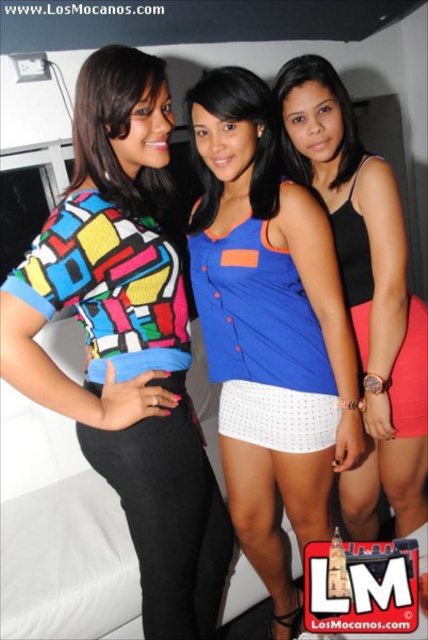
Is blue fabric top at center wider than blue fabric blouse at center?

Yes, blue fabric top at center is wider than blue fabric blouse at center.

Does point (300, 211) come in front of point (261, 90)?

No, it is behind (261, 90).

Does point (269, 468) come behind point (216, 108)?

Yes, it is.

The width and height of the screenshot is (428, 640). Identify the location of blue fabric top at center. (269, 330).

Can you confirm if multicolored knitted sweater at center is positioned to the right of blue fabric blouse at center?

In fact, multicolored knitted sweater at center is to the left of blue fabric blouse at center.

Can you confirm if multicolored knitted sweater at center is taller than blue fabric blouse at center?

Yes.

Find the location of a particular element. multicolored knitted sweater at center is located at coordinates (127, 339).

In the scene shown: Can you confirm if blue fabric top at center is positioned below multicolored fabric blouse at center?

Indeed, blue fabric top at center is positioned under multicolored fabric blouse at center.

Is point (356, 422) closer to viewer compared to point (127, 113)?

No, (356, 422) is further to viewer.

What do you see at coordinates (269, 330) in the screenshot? Image resolution: width=428 pixels, height=640 pixels. I see `blue fabric top at center` at bounding box center [269, 330].

The height and width of the screenshot is (640, 428). In order to click on blue fabric top at center in this screenshot , I will do `click(269, 330)`.